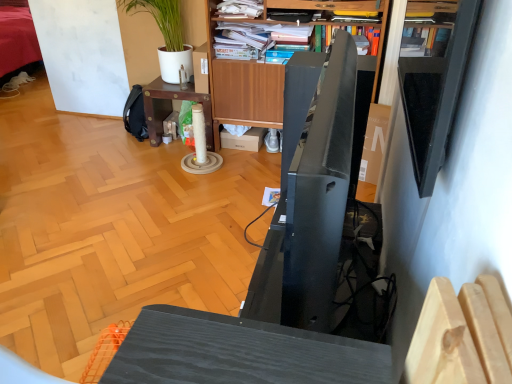
Question: Does wooden bookcase at upper center have a smaller size compared to wooden bookshelf at upper center?

Choices:
 (A) no
 (B) yes

Answer: (A)

Question: Does wooden bookcase at upper center have a larger size compared to wooden bookshelf at upper center?

Choices:
 (A) yes
 (B) no

Answer: (A)

Question: Is there a large distance between wooden bookcase at upper center and wooden bookshelf at upper center?

Choices:
 (A) yes
 (B) no

Answer: (B)

Question: Can wooden bookshelf at upper center be found inside wooden bookcase at upper center?

Choices:
 (A) yes
 (B) no

Answer: (A)

Question: Is wooden bookcase at upper center placed right next to wooden bookshelf at upper center?

Choices:
 (A) no
 (B) yes

Answer: (A)

Question: From a real-world perspective, is green matte plant at upper left positioned above or below wooden desk at center?

Choices:
 (A) below
 (B) above

Answer: (B)

Question: From the image's perspective, is green matte plant at upper left located above or below wooden desk at center?

Choices:
 (A) above
 (B) below

Answer: (A)

Question: Is green matte plant at upper left bigger or smaller than wooden desk at center?

Choices:
 (A) small
 (B) big

Answer: (A)

Question: In the image, is green matte plant at upper left positioned in front of or behind wooden desk at center?

Choices:
 (A) behind
 (B) front

Answer: (A)

Question: Is green matte plant at upper left in front of or behind hardcover book at upper center in the image?

Choices:
 (A) behind
 (B) front

Answer: (A)

Question: Is green matte plant at upper left taller or shorter than hardcover book at upper center?

Choices:
 (A) tall
 (B) short

Answer: (A)

Question: Considering the positions of green matte plant at upper left and hardcover book at upper center in the image, is green matte plant at upper left wider or thinner than hardcover book at upper center?

Choices:
 (A) thin
 (B) wide

Answer: (A)

Question: From a real-world perspective, relative to hardcover book at upper center, is green matte plant at upper left vertically above or below?

Choices:
 (A) above
 (B) below

Answer: (B)

Question: Relative to wooden bookshelf at upper center, is hardcover book at upper center in front or behind?

Choices:
 (A) behind
 (B) front

Answer: (A)

Question: From the image's perspective, is hardcover book at upper center positioned above or below wooden bookshelf at upper center?

Choices:
 (A) above
 (B) below

Answer: (B)